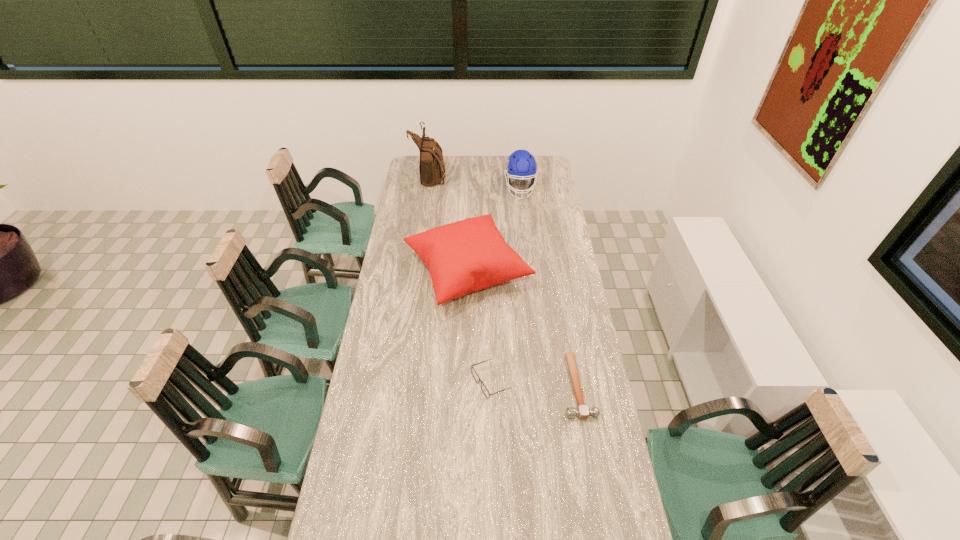
The image size is (960, 540). Identify the location of empty space between the shoulder bag and the third nearest object. (449, 223).

At what (x,y) coordinates should I click in order to perform the action: click on object that is the fourth nearest to the hammer. Please return your answer as a coordinate pair (x, y). The image size is (960, 540). Looking at the image, I should click on (431, 166).

What are the coordinates of `the second closest object to the shortest object` in the screenshot? It's located at (474, 373).

Where is `vacant position in the image that satisfies the following two spatial constraints: 1. with the lenses facing outward on the second shortest object; 2. on the right side of the shortest object`? The image size is (960, 540). vacant position in the image that satisfies the following two spatial constraints: 1. with the lenses facing outward on the second shortest object; 2. on the right side of the shortest object is located at coordinates (492, 386).

Where is `vacant space that satisfies the following two spatial constraints: 1. on the face guard of the football helmet; 2. with the lenses facing outward on the fourth tallest object`? Image resolution: width=960 pixels, height=540 pixels. vacant space that satisfies the following two spatial constraints: 1. on the face guard of the football helmet; 2. with the lenses facing outward on the fourth tallest object is located at coordinates (541, 382).

This screenshot has width=960, height=540. Identify the location of free space in the image that satisfies the following two spatial constraints: 1. on the face guard of the football helmet; 2. with the lenses facing outward on the fourth tallest object. (541, 382).

Where is `blank space that satisfies the following two spatial constraints: 1. on the face guard of the football helmet; 2. with the lenses facing outward on the second shortest object`? The width and height of the screenshot is (960, 540). blank space that satisfies the following two spatial constraints: 1. on the face guard of the football helmet; 2. with the lenses facing outward on the second shortest object is located at coordinates (541, 382).